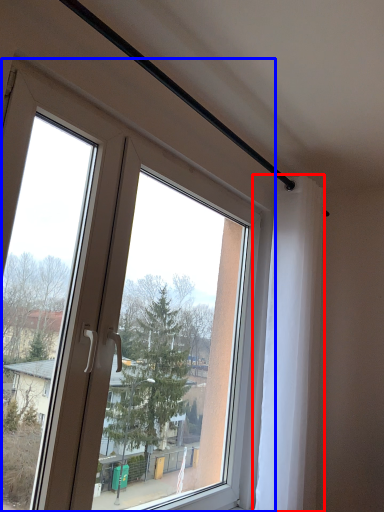
Question: Which point is closer to the camera, curtain (highlighted by a red box) or window (highlighted by a blue box)?

Choices:
 (A) curtain
 (B) window

Answer: (B)